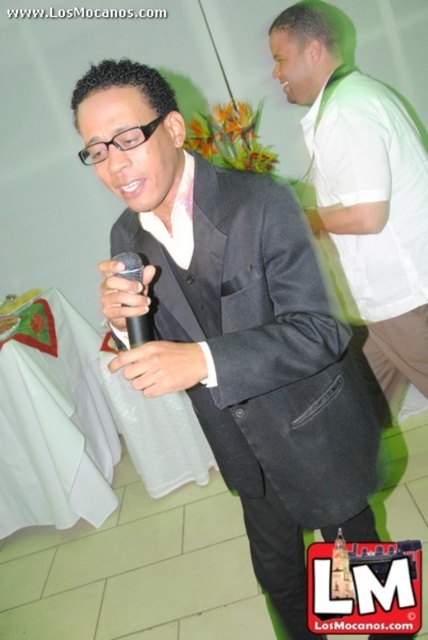
You are at a social event and see the white matte shirt at upper right and the black matte microphone at center. Which object is located to the right of the other?

The white matte shirt at upper right is positioned on the right side of black matte microphone at center.

You are at a social event and need to determine if the matte black suit at center can completely cover the black matte microphone at center when placed over it. Based on their sizes, what is your conclusion?

The matte black suit at center is bigger than the black matte microphone at center, so it can completely cover it when placed over it.